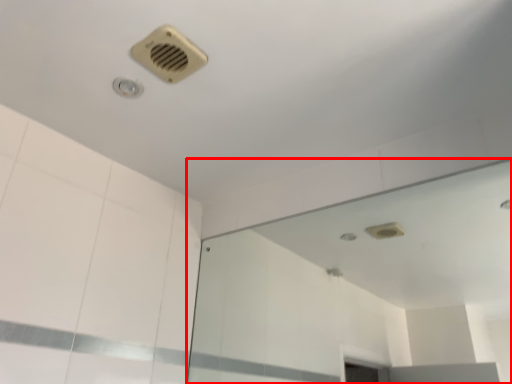
Question: From the image, what is the correct spatial relationship of mirror (annotated by the red box) in relation to air conditioning?

Choices:
 (A) right
 (B) left

Answer: (A)